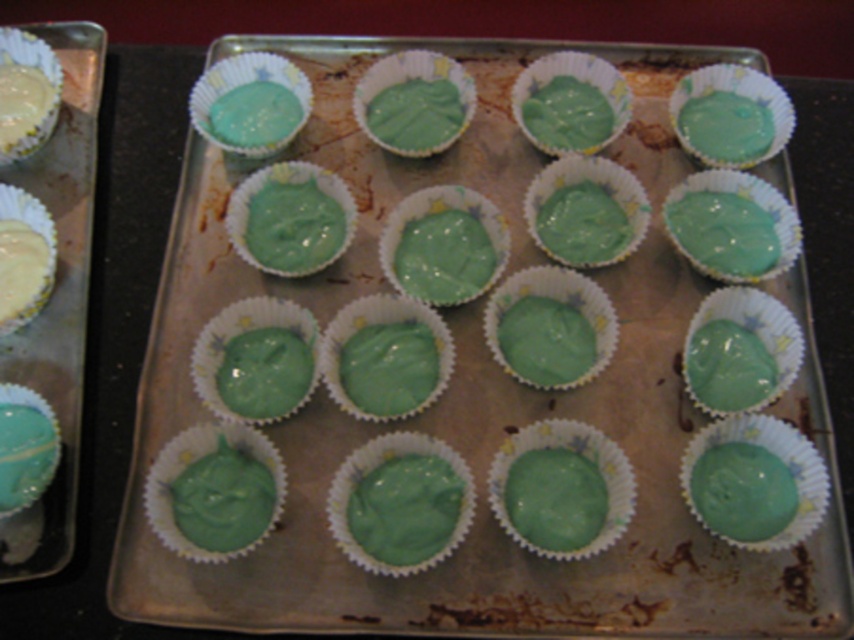
You are a baker standing in front of the cupcakes and need to grab the matte green cupcake at center. If your hand can reach up to 3.5 feet, will you be able to reach it?

The matte green cupcake at center and viewer are 3.67 feet apart from each other. Since your hand can only reach up to 3.5 feet, you cannot reach the matte green cupcake at center.

You are a photographer adjusting your camera to focus on two specific points in the image of the cupcakes. The points are labeled as point 1 at coordinates point (273, 536) and point 2 at coordinates point (3, 106). Which point should you focus on first if you want to ensure both points are in focus?

You should focus on point 1 at coordinates point (273, 536) first because it is closer to the camera than point 2 at coordinates point (3, 106). This ensures that both points will be in focus when using depth of field appropriately.